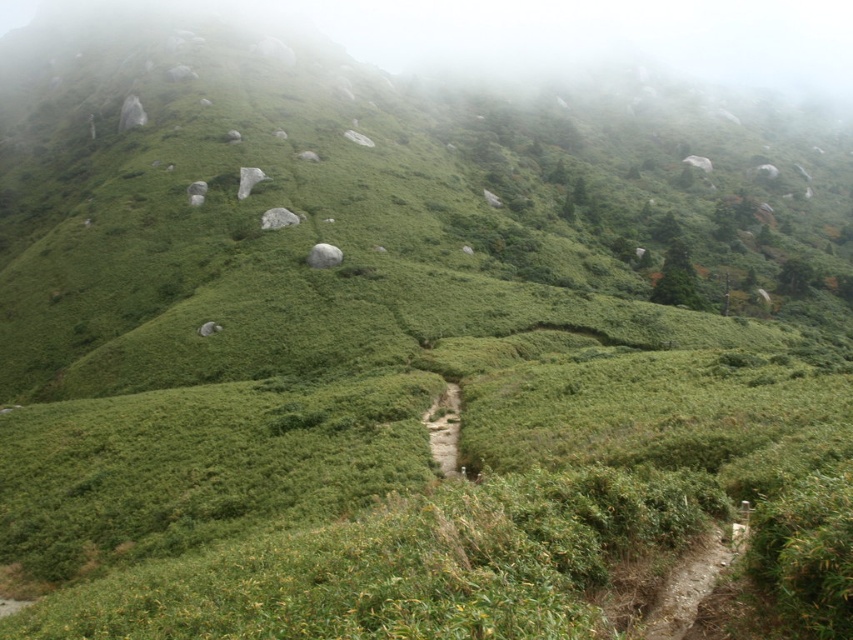
Question: Which point appears closest to the camera in this image?

Choices:
 (A) (712, 554)
 (B) (428, 406)

Answer: (A)

Question: Among these points, which one is farthest from the camera?

Choices:
 (A) (444, 403)
 (B) (685, 289)

Answer: (B)

Question: Is dirt path at lower right further to camera compared to green grassy trail at center?

Choices:
 (A) yes
 (B) no

Answer: (B)

Question: Is dirt path at lower right positioned in front of green leafy tree at upper center?

Choices:
 (A) no
 (B) yes

Answer: (B)

Question: In this image, where is dirt path at lower right located relative to green leafy tree at upper center?

Choices:
 (A) left
 (B) right

Answer: (A)

Question: Which object is positioned farthest from the dirt path at lower right?

Choices:
 (A) green leafy tree at upper center
 (B) green grassy trail at center

Answer: (A)